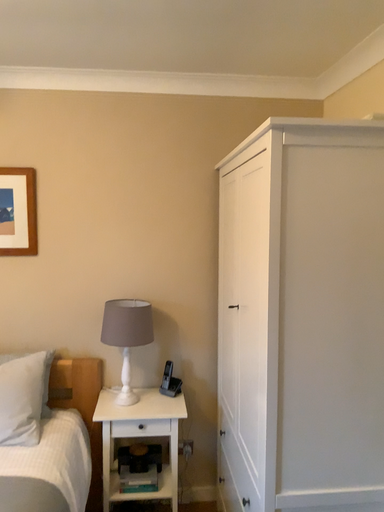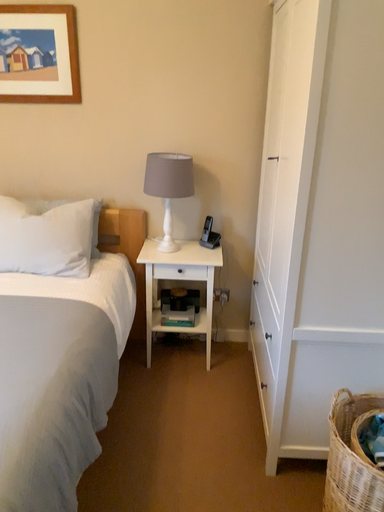
Question: How did the camera likely rotate when shooting the video?

Choices:
 (A) rotated upward
 (B) rotated downward

Answer: (B)